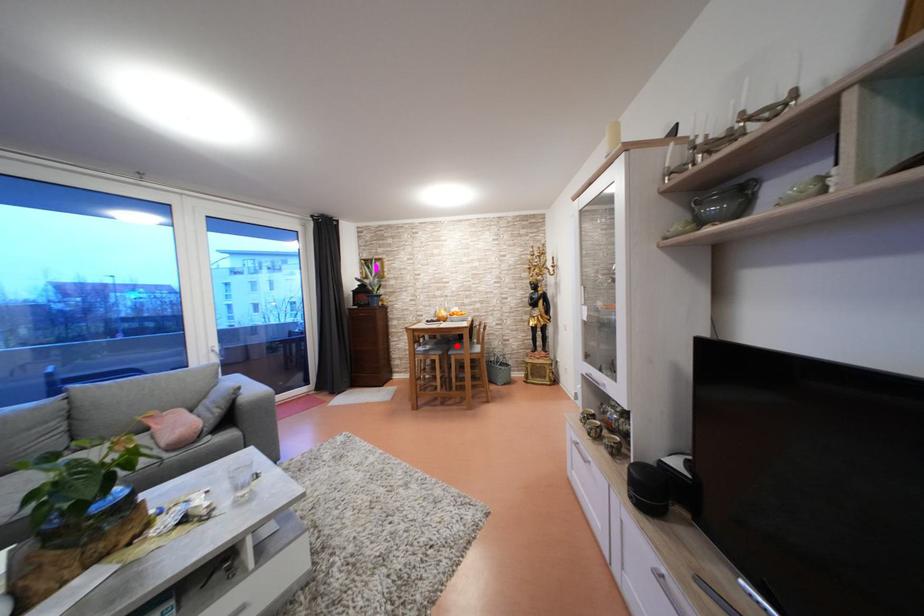
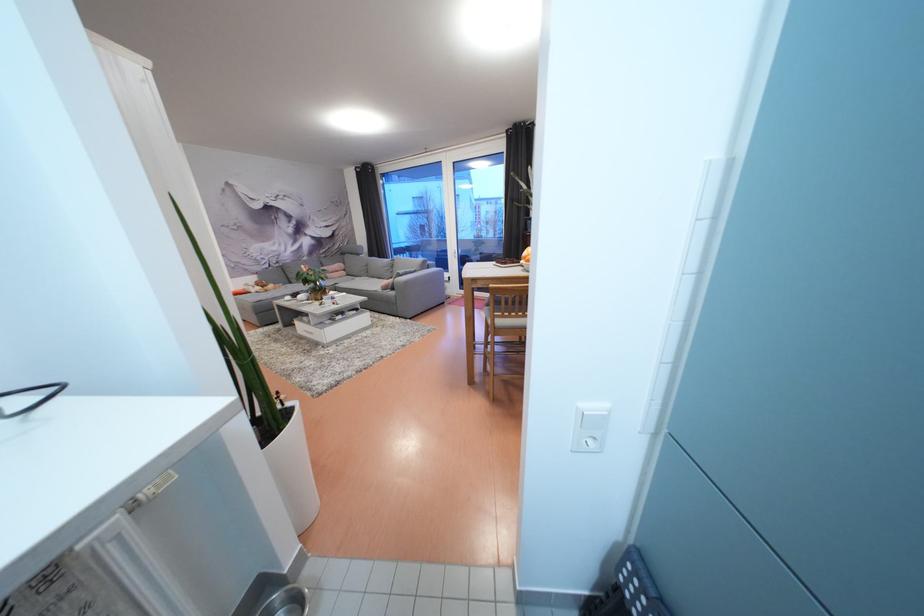
Question: I am providing you with two images of the same scene from different viewpoints. A red point is marked on the first image. At the location where the point appears in image 1, is it still visible in image 2?

Choices:
 (A) Yes
 (B) No

Answer: (B)